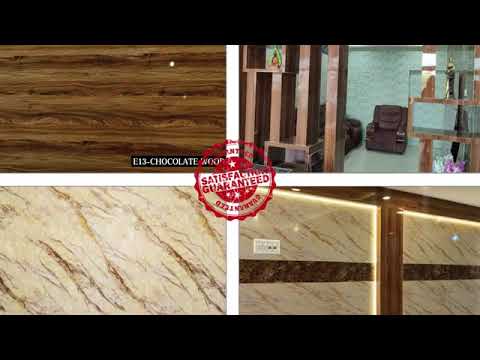
This screenshot has width=480, height=360. Find the location of `area above light switch`. area above light switch is located at coordinates (265, 229).